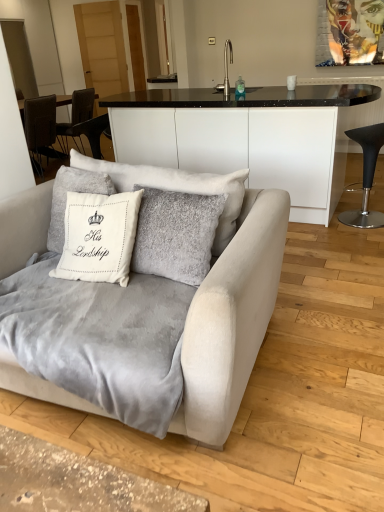
What do you see at coordinates (226, 70) in the screenshot? This screenshot has height=512, width=384. I see `metallic faucet at upper center` at bounding box center [226, 70].

In order to face suede gray couch at lower left, should I rotate leftwards or rightwards?

Rotate your view left by about 10.124°.

Where is `suede gray couch at lower left`? suede gray couch at lower left is located at coordinates (231, 318).

You are a GUI agent. You are given a task and a screenshot of the screen. Output one action in this format:
    pyautogui.click(x=<x>, y=<y>)
    Task: Click on the metallic faucet at upper center
    The image size is (384, 512).
    Given the screenshot: What is the action you would take?
    pyautogui.click(x=226, y=70)

Is suede gray couch at lower left situated inside white soft cushion at center or outside?

suede gray couch at lower left exists outside the volume of white soft cushion at center.

At what (x,y) coordinates should I click in order to perform the action: click on studio couch located underneath the white soft cushion at center (from a real-world perspective). Please return your answer as a coordinate pair (x, y). Looking at the image, I should click on (231, 318).

From a real-world perspective, is suede gray couch at lower left on white soft cushion at center?

No, from a real-world perspective, suede gray couch at lower left is not over white soft cushion at center

Is black leather stool at right behind suede gray couch at lower left?

Yes, the depth of black leather stool at right is greater than that of suede gray couch at lower left.

From the image's perspective, which object appears higher, black leather stool at right or suede gray couch at lower left?

black leather stool at right is shown above in the image.

At what (x,y) coordinates should I click in order to perform the action: click on studio couch in front of the black leather stool at right. Please return your answer as a coordinate pair (x, y). The image size is (384, 512). Looking at the image, I should click on click(231, 318).

From the picture: Which of these two, white soft cushion at center or metallic faucet at upper center, stands shorter?

Standing shorter between the two is metallic faucet at upper center.

Is white soft cushion at center in front of or behind metallic faucet at upper center in the image?

In the image, white soft cushion at center appears in front of metallic faucet at upper center.

From a real-world perspective, is white soft cushion at center positioned above or below metallic faucet at upper center?

Clearly, from a real-world perspective, white soft cushion at center is below metallic faucet at upper center.

Who is smaller, white soft cushion at center or metallic faucet at upper center?

metallic faucet at upper center is smaller.

Who is bigger, white soft cushion at center or suede gray couch at lower left?

With larger size is suede gray couch at lower left.

Between white soft cushion at center and suede gray couch at lower left, which one has larger width?

suede gray couch at lower left is wider.

Could you tell me if white soft cushion at center is facing suede gray couch at lower left?

Yes, white soft cushion at center is turned towards suede gray couch at lower left.

Is metallic faucet at upper center beside black leather stool at right?

No, metallic faucet at upper center is not in contact with black leather stool at right.

In the scene shown: Considering the relative sizes of metallic faucet at upper center and black leather stool at right in the image provided, is metallic faucet at upper center thinner than black leather stool at right?

Correct, the width of metallic faucet at upper center is less than that of black leather stool at right.

Is black leather stool at right at the back of metallic faucet at upper center?

No, black leather stool at right is not at the back of metallic faucet at upper center.

Considering the sizes of objects metallic faucet at upper center and black leather stool at right in the image provided, who is smaller, metallic faucet at upper center or black leather stool at right?

metallic faucet at upper center.

Where is `chair lying behind the white soft cushion at center`? Image resolution: width=384 pixels, height=512 pixels. chair lying behind the white soft cushion at center is located at coordinates (366, 176).

Does point (361, 130) come in front of point (244, 179)?

No, it is behind (244, 179).

Would you say black leather stool at right is to the left or to the right of white soft cushion at center in the picture?

In the image, black leather stool at right appears on the right side of white soft cushion at center.

From the image's perspective, which is below, black leather stool at right or white soft cushion at center?

white soft cushion at center appears lower in the image.

Does point (230, 45) come in front of point (97, 170)?

No, (230, 45) is further to viewer.

Would you say white soft cushion at center is part of metallic faucet at upper center's contents?

Definitely not — white soft cushion at center is not inside metallic faucet at upper center.

Who is taller, metallic faucet at upper center or white soft cushion at center?

Standing taller between the two is white soft cushion at center.

The height and width of the screenshot is (512, 384). I want to click on pillow behind the suede gray couch at lower left, so click(177, 187).

The image size is (384, 512). I want to click on chair lying above the suede gray couch at lower left (from the image's perspective), so click(366, 176).

When comparing their distances from metallic faucet at upper center, does suede gray couch at lower left or black leather stool at right seem closer?

Among the two, black leather stool at right is located nearer to metallic faucet at upper center.

In the scene shown: Looking at the image, which one is located further to black leather stool at right, white soft cushion at center or suede gray couch at lower left?

suede gray couch at lower left is further to black leather stool at right.

Which object lies further to the anchor point suede gray couch at lower left, metallic faucet at upper center or white soft cushion at center?

metallic faucet at upper center is further to suede gray couch at lower left.

From the image, which object appears to be nearer to suede gray couch at lower left, white soft cushion at center or black leather stool at right?

Based on the image, white soft cushion at center appears to be nearer to suede gray couch at lower left.

Which object lies further to the anchor point suede gray couch at lower left, white soft cushion at center or metallic faucet at upper center?

metallic faucet at upper center.

Estimate the real-world distances between objects in this image. Which object is closer to metallic faucet at upper center, white soft cushion at center or black leather stool at right?

black leather stool at right lies closer to metallic faucet at upper center than the other object.

From the image, which object appears to be farther from white soft cushion at center, metallic faucet at upper center or suede gray couch at lower left?

The object further to white soft cushion at center is metallic faucet at upper center.

Looking at the image, which one is located further to metallic faucet at upper center, black leather stool at right or white soft cushion at center?

Based on the image, white soft cushion at center appears to be further to metallic faucet at upper center.

Locate an element on the screen. This screenshot has height=512, width=384. chair located between white soft cushion at center and metallic faucet at upper center in the depth direction is located at coordinates (366, 176).

You are a GUI agent. You are given a task and a screenshot of the screen. Output one action in this format:
    pyautogui.click(x=<x>, y=<y>)
    Task: Click on the pillow between suede gray couch at lower left and metallic faucet at upper center in the front-back direction
    
    Given the screenshot: What is the action you would take?
    pyautogui.click(x=177, y=187)

Locate an element on the screen. pillow between suede gray couch at lower left and black leather stool at right from front to back is located at coordinates (177, 187).

This screenshot has width=384, height=512. In order to click on chair located between suede gray couch at lower left and metallic faucet at upper center in the depth direction in this screenshot , I will do `click(366, 176)`.